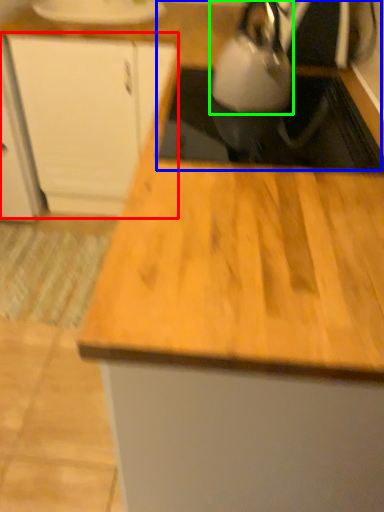
Question: Which object is positioned closest to cabinetry (highlighted by a red box)? Select from sink (highlighted by a blue box) and kettle (highlighted by a green box).

Choices:
 (A) sink
 (B) kettle

Answer: (B)